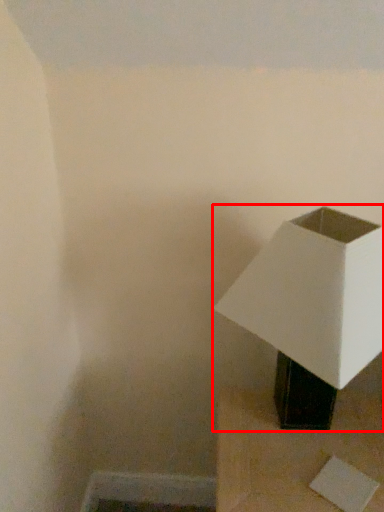
Question: From the image, what is the correct spatial relationship of lamp (annotated by the red box) in relation to furniture?

Choices:
 (A) left
 (B) right

Answer: (A)